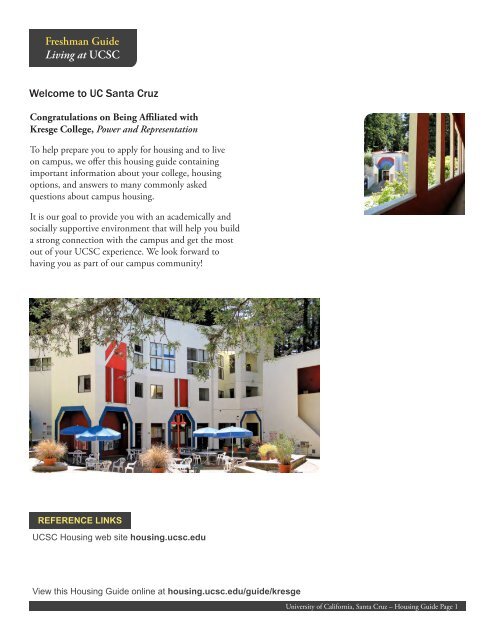
The image size is (495, 640). What are the coordinates of `chairs` in the screenshot? It's located at (106, 464), (122, 463), (134, 468), (131, 454), (190, 463), (219, 457), (228, 463).